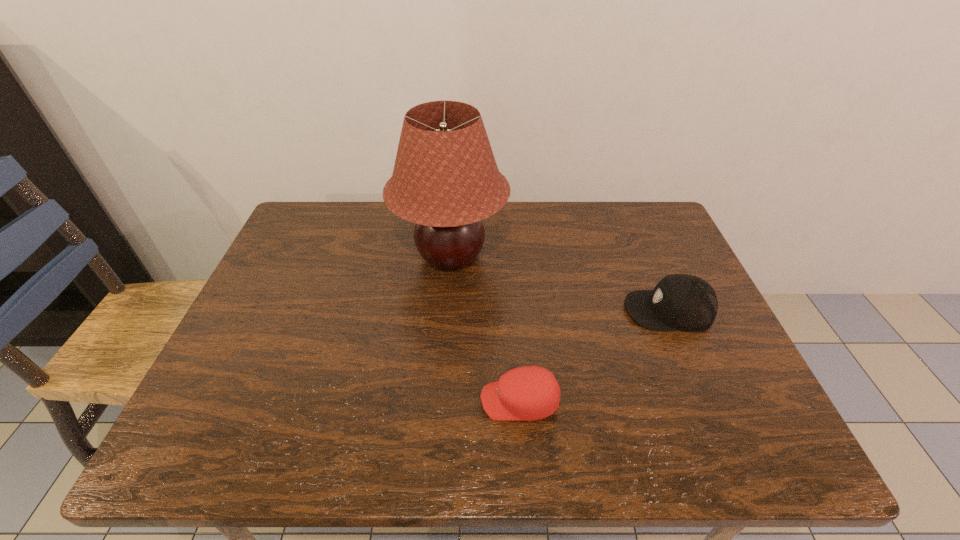
I want to click on lampshade, so click(x=445, y=179).

Find the location of a particular element. The height and width of the screenshot is (540, 960). the taller cap is located at coordinates (684, 302).

Image resolution: width=960 pixels, height=540 pixels. What are the coordinates of `the farther cap` in the screenshot? It's located at (684, 302).

The image size is (960, 540). What are the coordinates of `the shorter cap` in the screenshot? It's located at (528, 393).

Locate an element on the screen. Image resolution: width=960 pixels, height=540 pixels. the nearest object is located at coordinates (528, 393).

Where is `free region located on the front-facing side of the lampshade`? The image size is (960, 540). free region located on the front-facing side of the lampshade is located at coordinates (443, 366).

This screenshot has height=540, width=960. In order to click on free region located 0.100m on the front-facing side of the rightmost object in this screenshot , I will do (x=586, y=310).

This screenshot has width=960, height=540. I want to click on free space located on the front-facing side of the rightmost object, so click(522, 310).

You are a GUI agent. You are given a task and a screenshot of the screen. Output one action in this format:
    pyautogui.click(x=<x>, y=<y>)
    Task: Click on the free space located 0.170m on the front-facing side of the rightmost object
    This screenshot has height=540, width=960.
    Given the screenshot: What is the action you would take?
    pyautogui.click(x=558, y=310)

The height and width of the screenshot is (540, 960). What are the coordinates of `vacant space located 0.050m on the front-facing side of the left cap` in the screenshot? It's located at (456, 401).